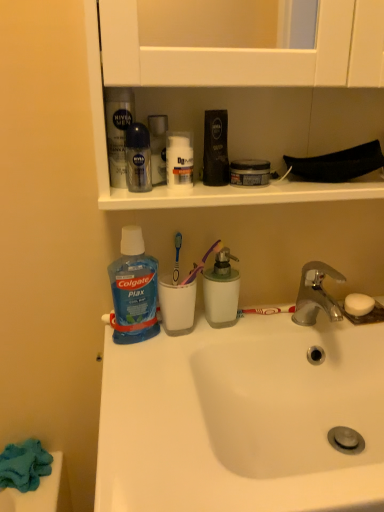
The height and width of the screenshot is (512, 384). I want to click on vacant area that is situated to the right of white plastic toothbrush at sink, which is the 3th toothbrush in left-to-right order, so click(x=326, y=326).